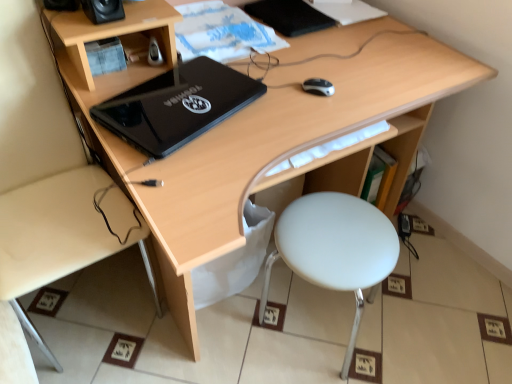
Question: Can you confirm if black plastic mouse at center is taller than black matte speaker at upper left, the second speaker viewed from the left?

Choices:
 (A) no
 (B) yes

Answer: (A)

Question: Is black plastic mouse at center in front of black matte speaker at upper left, the second speaker viewed from the left?

Choices:
 (A) no
 (B) yes

Answer: (A)

Question: Is black matte speaker at upper left, the first speaker in the right-to-left sequence, inside black plastic mouse at center?

Choices:
 (A) yes
 (B) no

Answer: (B)

Question: Considering the relative positions of black plastic mouse at center and black matte speaker at upper left, the second speaker viewed from the left, in the image provided, is black plastic mouse at center to the right of black matte speaker at upper left, the second speaker viewed from the left, from the viewer's perspective?

Choices:
 (A) yes
 (B) no

Answer: (A)

Question: Is black plastic mouse at center touching black matte speaker at upper left, the first speaker in the right-to-left sequence?

Choices:
 (A) no
 (B) yes

Answer: (A)

Question: Is black plastic mouse at center facing away from black matte speaker at upper left, the first speaker in the right-to-left sequence?

Choices:
 (A) yes
 (B) no

Answer: (B)

Question: Is black matte speaker at upper left, the first speaker in the right-to-left sequence, shorter than black glossy laptop at center?

Choices:
 (A) no
 (B) yes

Answer: (A)

Question: Is black matte speaker at upper left, the first speaker in the right-to-left sequence, taller than black glossy laptop at center?

Choices:
 (A) yes
 (B) no

Answer: (A)

Question: From a real-world perspective, is black matte speaker at upper left, the second speaker viewed from the left, below black glossy laptop at center?

Choices:
 (A) no
 (B) yes

Answer: (A)

Question: Is black matte speaker at upper left, the first speaker in the right-to-left sequence, positioned far away from black glossy laptop at center?

Choices:
 (A) no
 (B) yes

Answer: (A)

Question: Does black matte speaker at upper left, the second speaker viewed from the left, have a greater width compared to black glossy laptop at center?

Choices:
 (A) no
 (B) yes

Answer: (A)

Question: Is black matte speaker at upper left, the second speaker viewed from the left, located outside black glossy laptop at center?

Choices:
 (A) yes
 (B) no

Answer: (A)

Question: Can you confirm if light wood desk at lower left is bigger than black plastic speaker at upper left, the 2th speaker from the right?

Choices:
 (A) yes
 (B) no

Answer: (A)